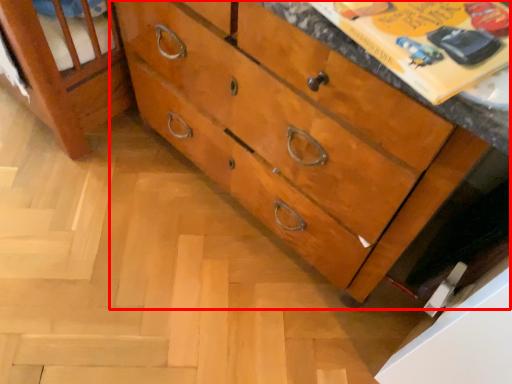
Question: Considering the relative positions of chest of drawers (annotated by the red box) and paperback book in the image provided, where is chest of drawers (annotated by the red box) located with respect to the staircase?

Choices:
 (A) left
 (B) right

Answer: (A)